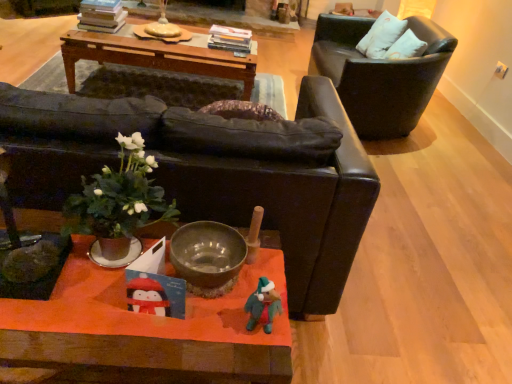
Question: Is wooden orange coffee table at center not inside black leather chair at upper right, the 1th chair viewed from the right?

Choices:
 (A) no
 (B) yes

Answer: (B)

Question: Are wooden orange coffee table at center and black leather chair at upper right, positioned as the first chair in back-to-front order, making contact?

Choices:
 (A) yes
 (B) no

Answer: (B)

Question: Is wooden orange coffee table at center behind black leather chair at upper right, acting as the second chair starting from the front?

Choices:
 (A) no
 (B) yes

Answer: (A)

Question: Can you confirm if wooden orange coffee table at center is shorter than black leather chair at upper right, placed as the 2th chair when sorted from left to right?

Choices:
 (A) yes
 (B) no

Answer: (A)

Question: Can you confirm if wooden orange coffee table at center is positioned to the right of black leather chair at upper right, the 1th chair viewed from the right?

Choices:
 (A) no
 (B) yes

Answer: (A)

Question: From the image's perspective, relative to wooden orange coffee table at center, is green leafy plant at center above or below?

Choices:
 (A) above
 (B) below

Answer: (A)

Question: Is point (79, 226) positioned closer to the camera than point (132, 365)?

Choices:
 (A) farther
 (B) closer

Answer: (A)

Question: Considering the positions of green leafy plant at center and wooden orange coffee table at center in the image, is green leafy plant at center wider or thinner than wooden orange coffee table at center?

Choices:
 (A) wide
 (B) thin

Answer: (B)

Question: From a real-world perspective, relative to wooden orange coffee table at center, is green leafy plant at center vertically above or below?

Choices:
 (A) above
 (B) below

Answer: (A)

Question: Is black leather chair at upper right, the 1th chair viewed from the right, taller or shorter than woodenmaterial/texturetable at upper center?

Choices:
 (A) tall
 (B) short

Answer: (A)

Question: From a real-world perspective, relative to woodenmaterial/texturetable at upper center, is black leather chair at upper right, positioned as the first chair in back-to-front order, vertically above or below?

Choices:
 (A) below
 (B) above

Answer: (B)

Question: Considering the positions of black leather chair at upper right, the 1th chair viewed from the right, and woodenmaterial/texturetable at upper center in the image, is black leather chair at upper right, the 1th chair viewed from the right, wider or thinner than woodenmaterial/texturetable at upper center?

Choices:
 (A) wide
 (B) thin

Answer: (A)

Question: Visually, is black leather chair at upper right, acting as the second chair starting from the front, positioned to the left or to the right of woodenmaterial/texturetable at upper center?

Choices:
 (A) right
 (B) left

Answer: (A)

Question: Is point (228, 233) positioned closer to the camera than point (379, 96)?

Choices:
 (A) farther
 (B) closer

Answer: (B)

Question: In terms of height, does metallic silver bowl at center look taller or shorter compared to black leather chair at upper right, acting as the second chair starting from the front?

Choices:
 (A) tall
 (B) short

Answer: (B)